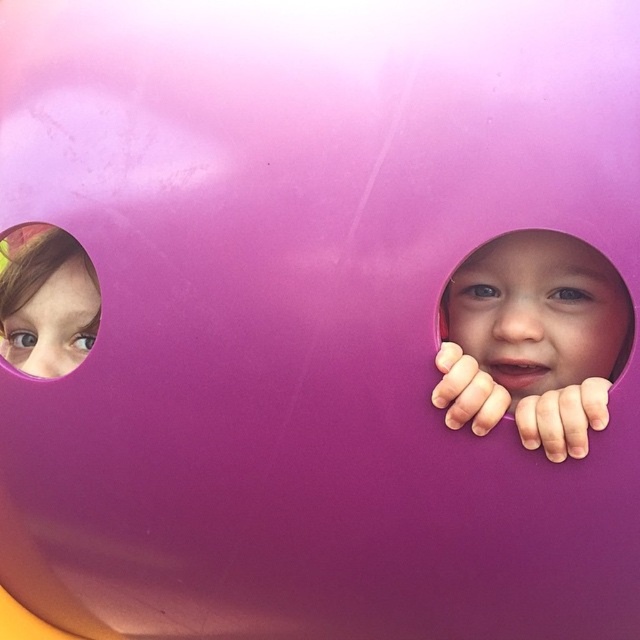
Question: Is matte purple face at right smaller than pink matte hole at upper left?

Choices:
 (A) yes
 (B) no

Answer: (B)

Question: Does matte purple face at right come in front of pink matte hole at upper left?

Choices:
 (A) yes
 (B) no

Answer: (A)

Question: Is matte purple face at right closer to the viewer compared to pink matte hole at upper left?

Choices:
 (A) no
 (B) yes

Answer: (B)